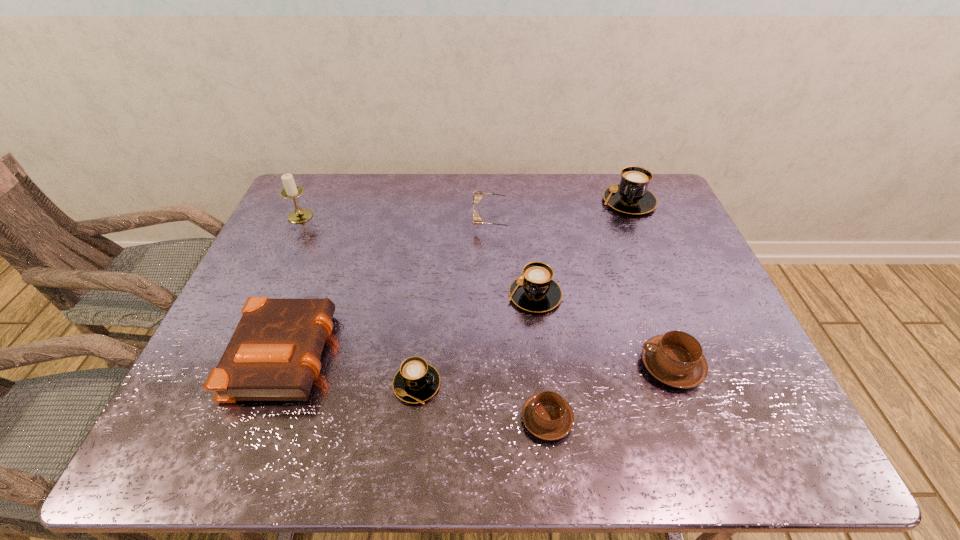
Locate an element on the screen. The image size is (960, 540). free spot between the left brown cappuccino and the candle holder is located at coordinates (423, 318).

Locate which object ranks third in proximity to the white candle holder. Please provide its 2D coordinates. Your answer should be formatted as a tuple, i.e. [(x, y)], where the tuple contains the x and y coordinates of a point satisfying the conditions above.

[(416, 381)]

Select which object appears as the closest to the biggest black cappuccino. Please provide its 2D coordinates. Your answer should be formatted as a tuple, i.e. [(x, y)], where the tuple contains the x and y coordinates of a point satisfying the conditions above.

[(477, 220)]

Locate an element on the screen. The width and height of the screenshot is (960, 540). the fourth closest cappuccino relative to the second farthest cappuccino is located at coordinates (631, 196).

Image resolution: width=960 pixels, height=540 pixels. I want to click on cappuccino that is the closest to the farthest cappuccino, so click(535, 291).

Find the location of a particular element. black cappuccino that stands as the second closest to the second tallest object is located at coordinates (416, 381).

Identify which black cappuccino is the third closest to the smaller brown cappuccino. Please provide its 2D coordinates. Your answer should be formatted as a tuple, i.e. [(x, y)], where the tuple contains the x and y coordinates of a point satisfying the conditions above.

[(631, 196)]

This screenshot has height=540, width=960. I want to click on free space that satisfies the following two spatial constraints: 1. on the side of the smaller brown cappuccino with the handle; 2. on the right side of the tallest cappuccino, so click(522, 201).

The width and height of the screenshot is (960, 540). What are the coordinates of `vacant point that satisfies the following two spatial constraints: 1. on the side of the nearer brown cappuccino with the handle; 2. on the spine side of the Bible` in the screenshot? It's located at (540, 351).

At what (x,y) coordinates should I click in order to perform the action: click on free spot that satisfies the following two spatial constraints: 1. on the spine side of the Bible; 2. on the side of the smaller brown cappuccino with the handle. Please return your answer as a coordinate pair (x, y). The image size is (960, 540). Looking at the image, I should click on (260, 419).